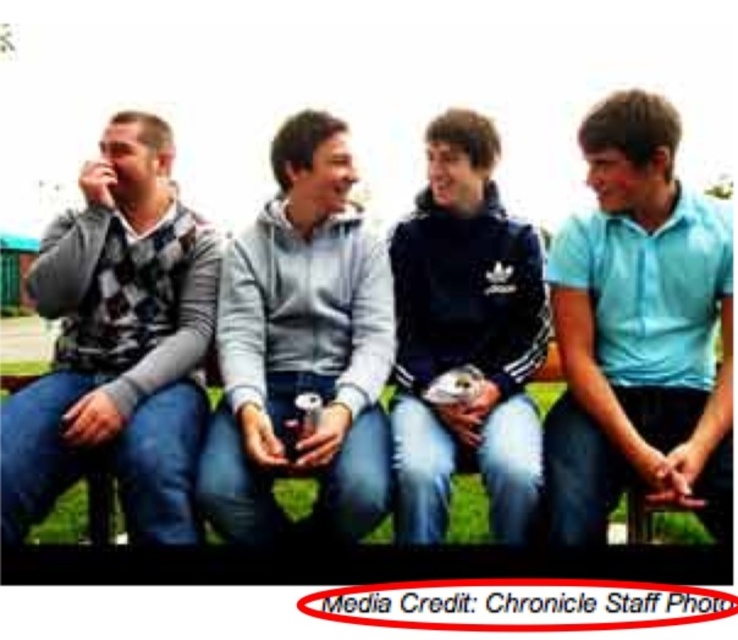
Can you confirm if light blue polo shirt at center is shorter than gray fleece hoodie at center?

Correct, light blue polo shirt at center is not as tall as gray fleece hoodie at center.

Does light blue polo shirt at center have a smaller size compared to gray fleece hoodie at center?

Indeed, light blue polo shirt at center has a smaller size compared to gray fleece hoodie at center.

Describe the element at coordinates (638, 332) in the screenshot. I see `light blue polo shirt at center` at that location.

Identify the location of light blue polo shirt at center. The width and height of the screenshot is (738, 640). (638, 332).

Is point (354, 305) farther from camera compared to point (407, 396)?

Yes, it is behind point (407, 396).

Which is more to the right, gray fleece hoodie at center or black matte jacket at center?

black matte jacket at center

Is point (311, 164) farther from camera compared to point (444, 465)?

Yes, point (311, 164) is farther from viewer.

In order to click on gray fleece hoodie at center in this screenshot , I will do pyautogui.click(x=300, y=348).

Is matte gray sweater at left above gray fleece hoodie at center?

Yes, matte gray sweater at left is above gray fleece hoodie at center.

Where is `matte gray sweater at left`? matte gray sweater at left is located at coordinates (117, 344).